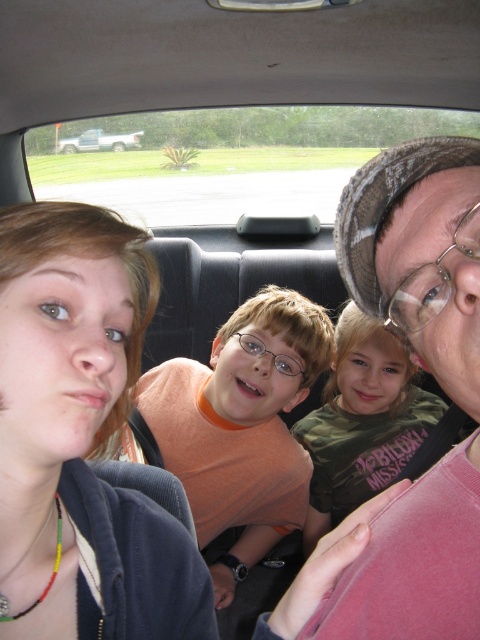
You are a passenger in the car and want to place a 10 cm wide phone on the seat. The pink fabric at upper right and the camouflage fabric shirt at center are on the seat. Which area has enough space to fit the phone without overlapping?

The camouflage fabric shirt at center has a greater width compared to the pink fabric at upper right, so placing the phone on the camouflage fabric shirt at center would provide enough space without overlapping.

You are a passenger in the car and want to hang a small bag on the hook located at the upper right. The bag is 10 cm tall. The pink fabric at upper right is 8 cm tall. Can the bag fit without overlapping the camouflage fabric shirt at center?

The pink fabric at upper right is 8 cm tall, which is shorter than the bag that is 10 cm tall. Therefore, the bag will overlap the camouflage fabric shirt at center when hung there.